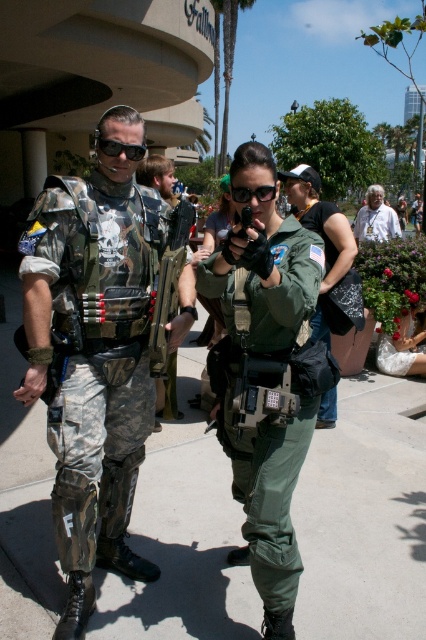
You are a photographer at the event and want to capture a photo that includes both the matte black goggles at left and the green matte goggles at center. Which goggles should you focus on first to ensure they are in the frame?

You should focus on the matte black goggles at left first because the green matte goggles at center is behind it, so ensuring the matte black goggles at left is positioned correctly will help frame the green matte goggles at center appropriately.

You are a photographer at the event and need to capture a closeup shot of the matte black gun at center and the green matte goggles at center. Since the camera lens can only focus on one object at a time, which object should you focus on first to ensure the larger object is in focus?

The matte black gun at center is larger than the green matte goggles at center, so you should focus on the matte black gun at center first to ensure it is in focus before adjusting for the smaller object.

You are a photographer at the event and need to frame a photo that includes both the green matte uniform at center and the matte black goggles at left. Based on their sizes, which object should you position closer to the edges of the frame to ensure both fit within the shot?

Since the green matte uniform at center is wider than the matte black goggles at left, you should position the wider green matte uniform at center near the center of the frame and place the narrower matte black goggles at left closer to the edge to ensure both fit within the shot.